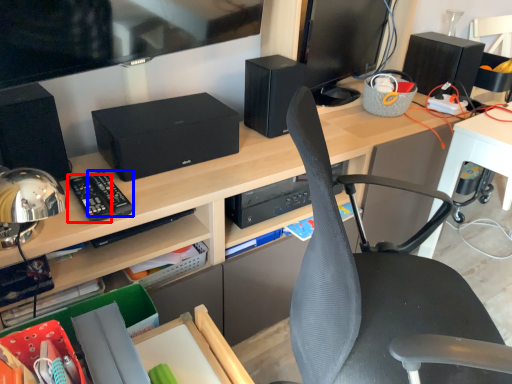
Question: Which object appears farthest to the camera in this image, control (highlighted by a red box) or control (highlighted by a blue box)?

Choices:
 (A) control
 (B) control

Answer: (B)